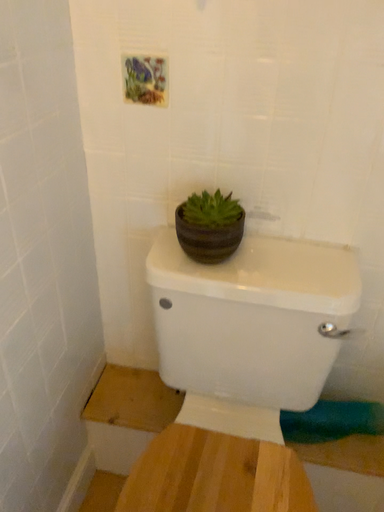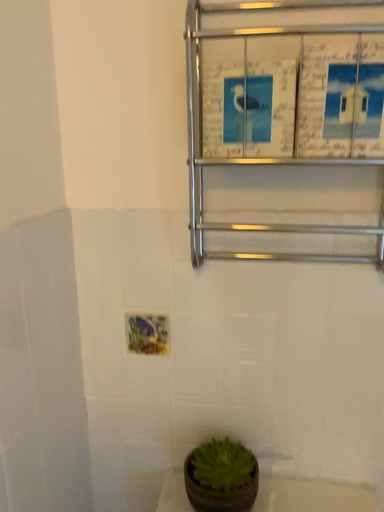
Question: How did the camera likely rotate when shooting the video?

Choices:
 (A) rotated downward
 (B) rotated upward

Answer: (B)